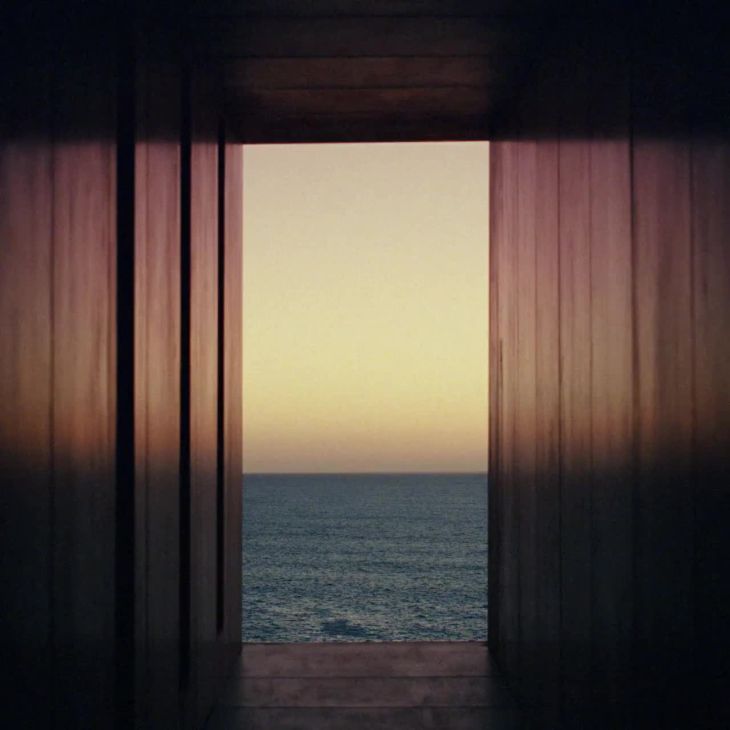
The image size is (730, 730). Find the location of `edge of the floor`. edge of the floor is located at coordinates (365, 642).